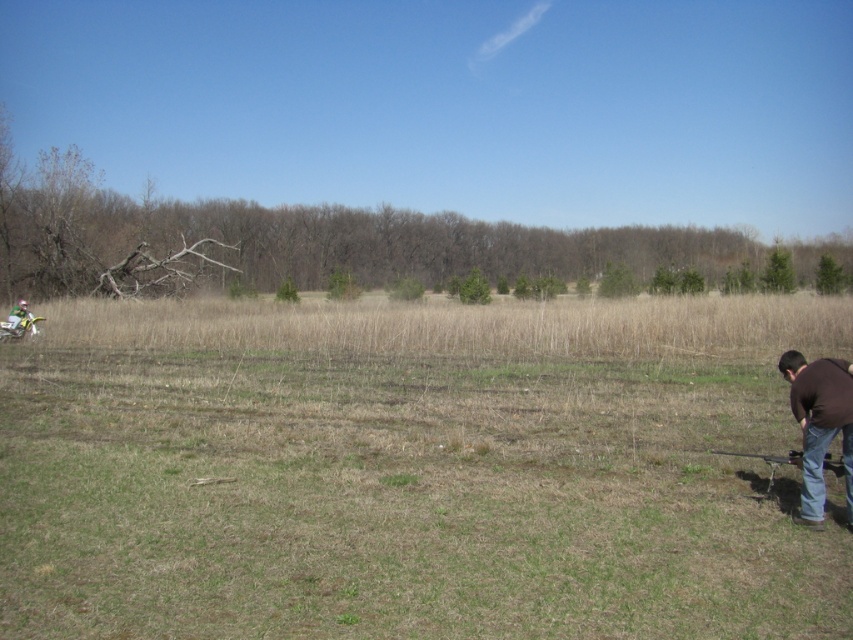
Question: Which object is positioned farthest from the brown cotton shirt at lower right?

Choices:
 (A) dry grass at center
 (B) green matte helmet at left

Answer: (B)

Question: Is dry grass at center in front of green matte helmet at left?

Choices:
 (A) yes
 (B) no

Answer: (A)

Question: Does brown cotton shirt at lower right come in front of green matte helmet at left?

Choices:
 (A) yes
 (B) no

Answer: (A)

Question: Estimate the real-world distances between objects in this image. Which object is farther from the dry grass at center?

Choices:
 (A) green matte helmet at left
 (B) brown cotton shirt at lower right

Answer: (A)

Question: Estimate the real-world distances between objects in this image. Which object is closer to the dry grass at center?

Choices:
 (A) green matte helmet at left
 (B) brown cotton shirt at lower right

Answer: (B)

Question: Does dry grass at center lie behind brown cotton shirt at lower right?

Choices:
 (A) no
 (B) yes

Answer: (A)